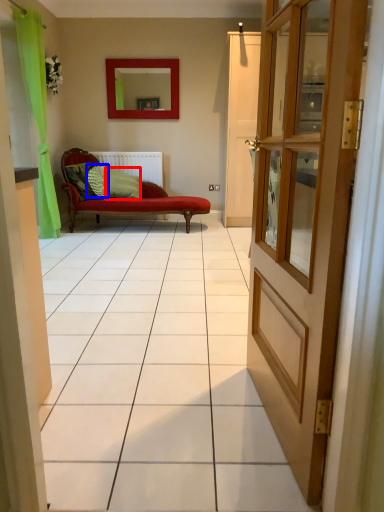
Question: Which object appears farthest to the camera in this image, pillow (highlighted by a red box) or pillow (highlighted by a blue box)?

Choices:
 (A) pillow
 (B) pillow

Answer: (A)